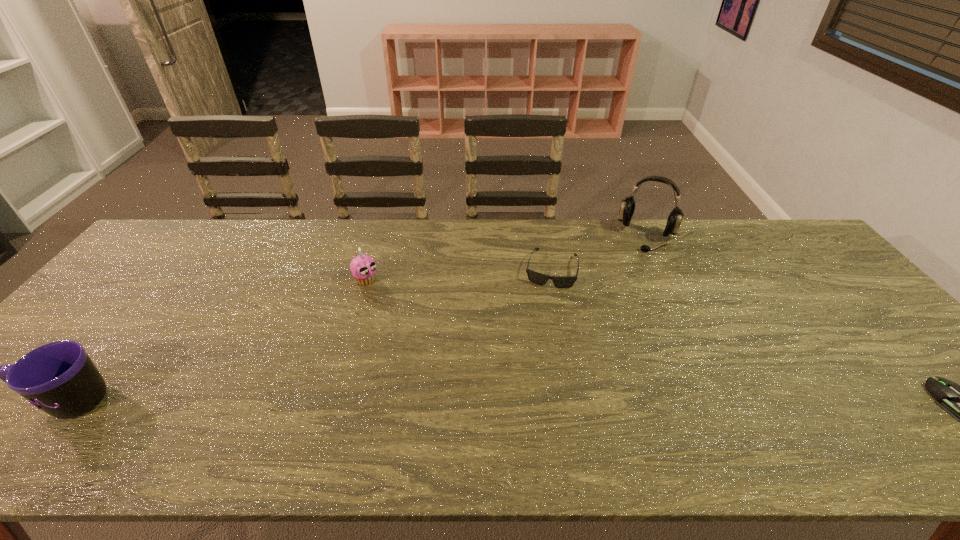
At what (x,y) coordinates should I click in order to perform the action: click on vacant area at the far edge. Please return your answer as a coordinate pair (x, y). The height and width of the screenshot is (540, 960). Looking at the image, I should click on (434, 226).

Image resolution: width=960 pixels, height=540 pixels. In the image, there is a desktop. What are the coordinates of `free space at the near edge` in the screenshot? It's located at click(637, 400).

In the image, there is a desktop. Where is `free space at the left edge`? free space at the left edge is located at coordinates (105, 350).

Find the location of a particular element. The width and height of the screenshot is (960, 540). vacant space at the right edge of the desktop is located at coordinates (815, 310).

At what (x,y) coordinates should I click in order to perform the action: click on free space at the far right corner of the desktop. Please return your answer as a coordinate pair (x, y). Looking at the image, I should click on (802, 258).

Where is `free space between the sunglasses and the cupcake`? This screenshot has width=960, height=540. free space between the sunglasses and the cupcake is located at coordinates (459, 274).

Identify the location of blank region between the mug and the fourth object from left to right. This screenshot has height=540, width=960. (359, 319).

Identify the location of empty location between the mug and the cupcake. Image resolution: width=960 pixels, height=540 pixels. (219, 341).

At what (x,y) coordinates should I click in order to perform the action: click on vacant point located between the cupcake and the tallest object. Please return your answer as a coordinate pair (x, y). Looking at the image, I should click on 507,258.

I want to click on vacant space in between the third object from right to left and the cupcake, so click(459, 274).